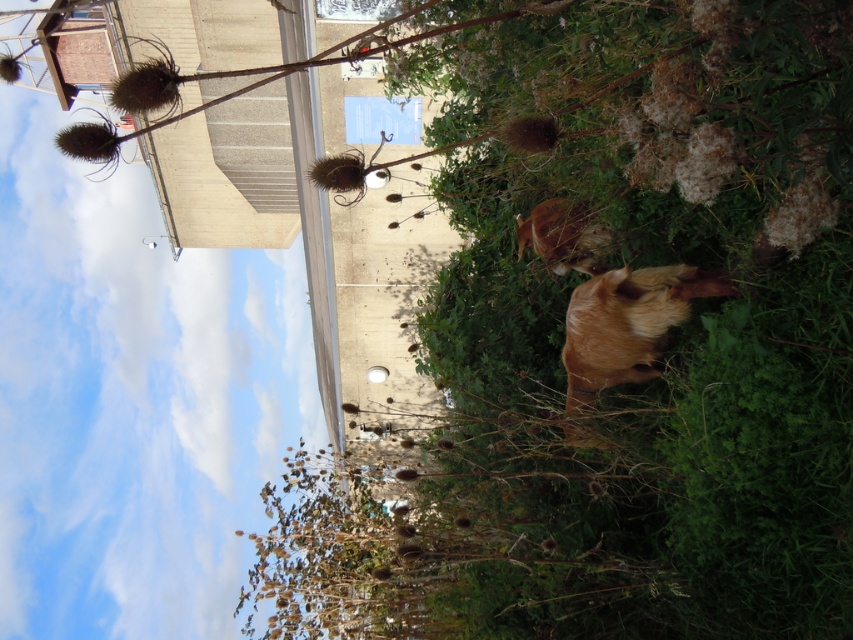
Question: Which object appears closest to the camera in this image?

Choices:
 (A) golden fur goat at center
 (B) brown furry dog at center

Answer: (A)

Question: Which of the following is the closest to the observer?

Choices:
 (A) golden fur goat at center
 (B) brown furry dog at center
 (C) brown fuzzy plant at center

Answer: (C)

Question: Which object is closer to the camera taking this photo?

Choices:
 (A) brown fuzzy plant at center
 (B) brown furry dog at center

Answer: (A)

Question: Is golden fur goat at center further to the viewer compared to brown furry dog at center?

Choices:
 (A) no
 (B) yes

Answer: (A)

Question: In this image, where is brown fuzzy plant at center located relative to brown furry dog at center?

Choices:
 (A) above
 (B) below

Answer: (B)

Question: Considering the relative positions of brown fuzzy plant at center and golden fur goat at center in the image provided, where is brown fuzzy plant at center located with respect to golden fur goat at center?

Choices:
 (A) above
 (B) below

Answer: (B)